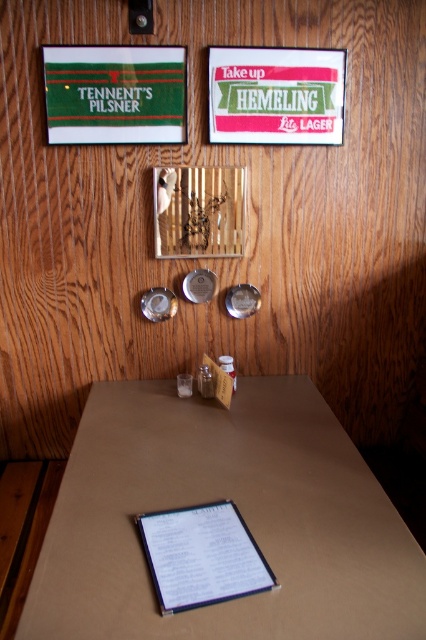
Question: Among these points, which one is farthest from the camera?

Choices:
 (A) (180, 212)
 (B) (178, 522)
 (C) (143, 104)

Answer: (A)

Question: Is brown cardboard table at center smaller than gold textured mirror at upper center?

Choices:
 (A) no
 (B) yes

Answer: (A)

Question: Which point is farther to the camera?

Choices:
 (A) (210, 515)
 (B) (81, 138)
 (C) (173, 182)

Answer: (C)

Question: Which object is positioned closest to the green fabric signboard at upper left?

Choices:
 (A) brown cardboard table at center
 (B) white paper clipboard at center
 (C) gold textured mirror at upper center

Answer: (C)

Question: Can you confirm if brown cardboard table at center is positioned to the left of white paper clipboard at center?

Choices:
 (A) no
 (B) yes

Answer: (A)

Question: Is brown cardboard table at center to the left of gold textured mirror at upper center from the viewer's perspective?

Choices:
 (A) yes
 (B) no

Answer: (B)